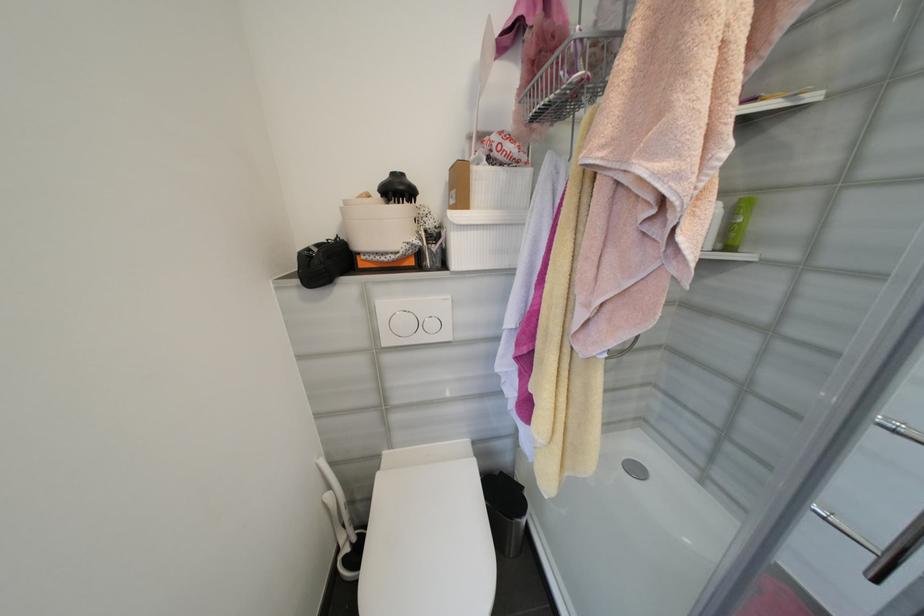
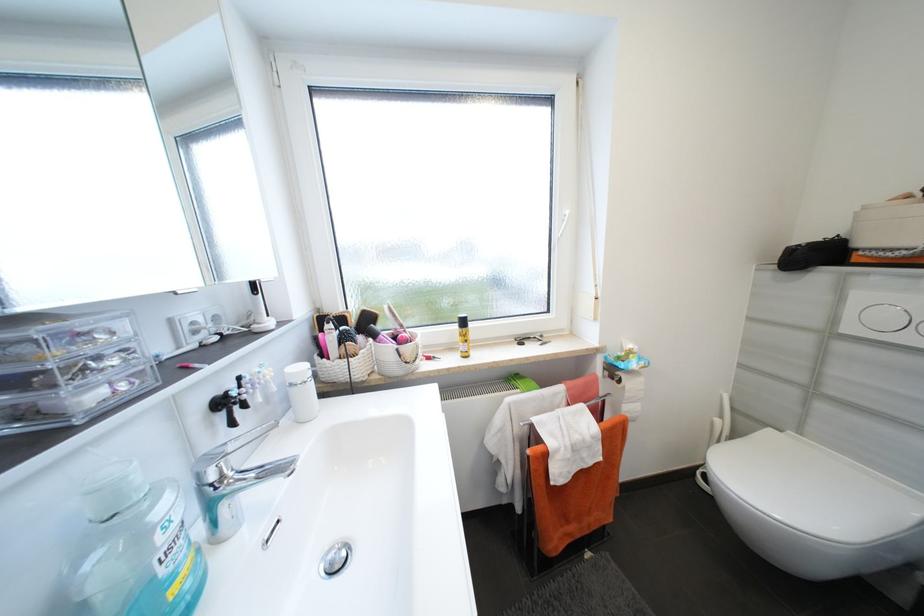
Question: Based on the continuous images, in which direction is the camera rotating? Reply with the corresponding letter.

Choices:
 (A) Left
 (B) Right
 (C) Up
 (D) Down

Answer: (A)